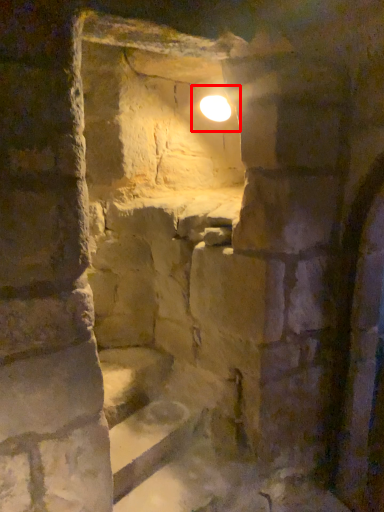
Question: From the image, what is the correct spatial relationship of light (annotated by the red box) in relation to stairs?

Choices:
 (A) right
 (B) left

Answer: (A)